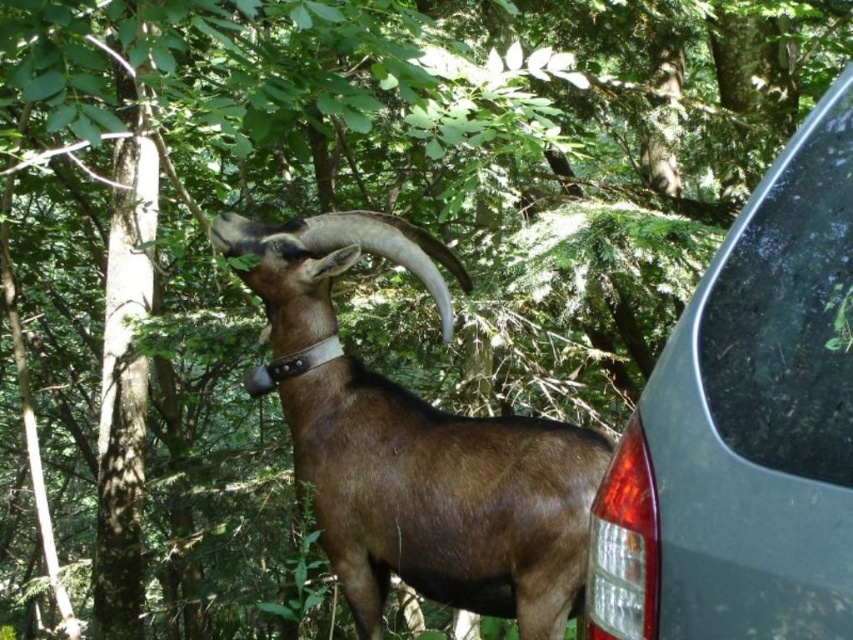
In the scene shown: You are a hiker who wants to take a photo of the brown matte goat at center and the transparent glass at right. If you want to include both in the frame without moving your position, which object should you focus on first to ensure both are in the shot?

The brown matte goat at center is wider than the transparent glass at right, so you should focus on the brown matte goat at center first to ensure both fit in the frame.

Based on the photo, you are a delivery robot with a width of 30 centimeters. You need to pass between the metallic gray car at right and the transparent glass at right. Can you fit through the space between them?

The distance between the metallic gray car at right and the transparent glass at right is 3.44 centimeters, which is much narrower than the robot width of 30 centimeters. Therefore, the delivery robot cannot fit through the space between them.